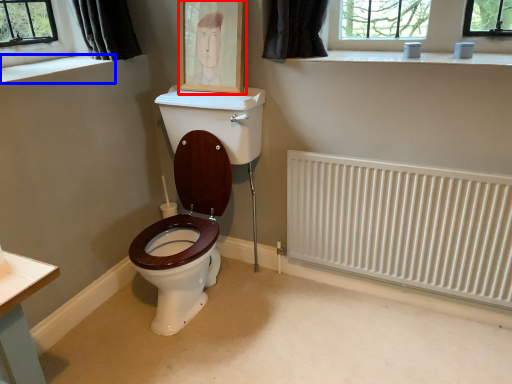
Question: Which of the following is the farthest to the observer, picture frame (highlighted by a red box) or window sill (highlighted by a blue box)?

Choices:
 (A) picture frame
 (B) window sill

Answer: (A)